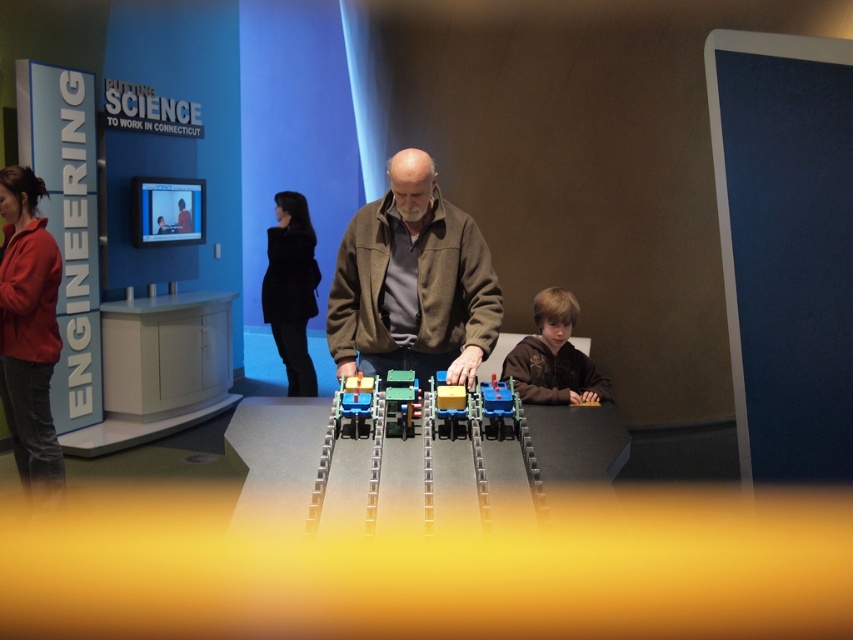
Is the position of blue plastic toy car at center more distant than that of matte plastic toy at center?

No, it is not.

Which of these two, blue plastic toy car at center or matte plastic toy at center, stands taller?

With more height is matte plastic toy at center.

Is point (511, 381) positioned behind point (456, 410)?

Yes.

At what (x,y) coordinates should I click in order to perform the action: click on blue plastic toy car at center. Please return your answer as a coordinate pair (x, y). Looking at the image, I should click on (498, 406).

Which is behind, point (413, 240) or point (373, 387)?

The point (413, 240) is more distant.

Find the location of a particular element. The height and width of the screenshot is (640, 853). brown matte jacket at center is located at coordinates (412, 282).

Which of these two, brown fuzzy jacket at lower right or translucent plastic train car at center, stands shorter?

Standing shorter between the two is translucent plastic train car at center.

Between brown fuzzy jacket at lower right and translucent plastic train car at center, which one is positioned lower?

brown fuzzy jacket at lower right

Is point (503, 356) less distant than point (376, 385)?

No, (503, 356) is further to viewer.

This screenshot has width=853, height=640. In order to click on brown fuzzy jacket at lower right in this screenshot , I will do `click(553, 356)`.